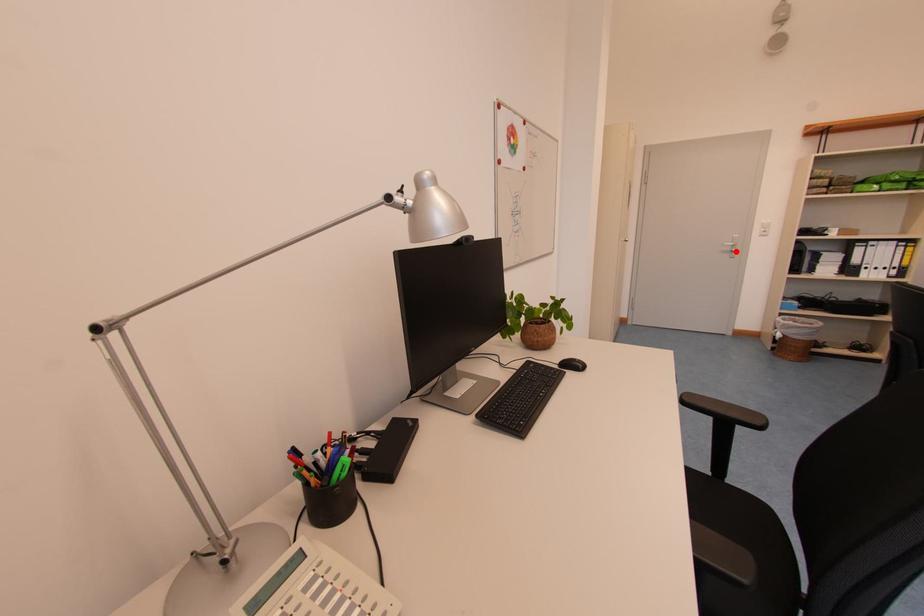
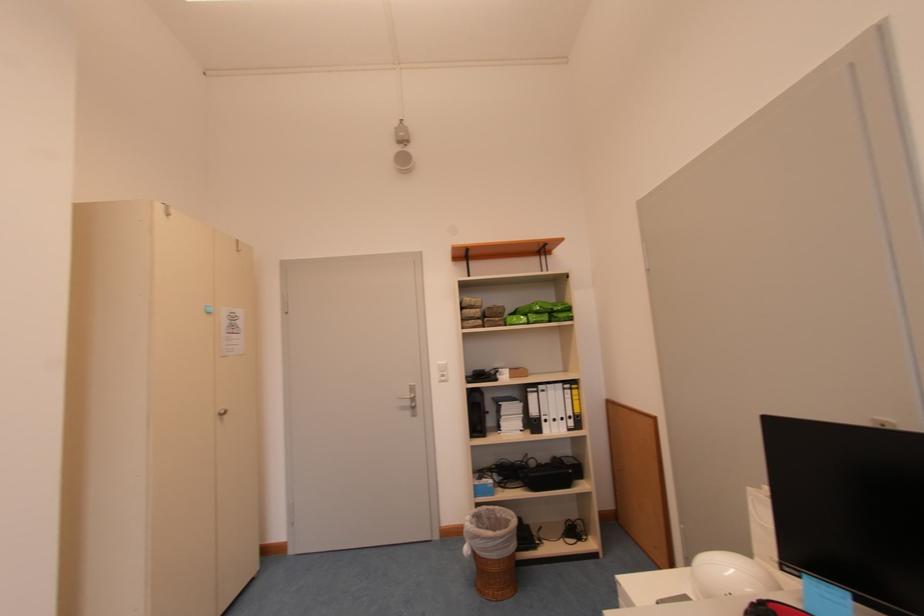
In the second image, find the point that corresponds to the highlighted location in the first image.

(415, 406)